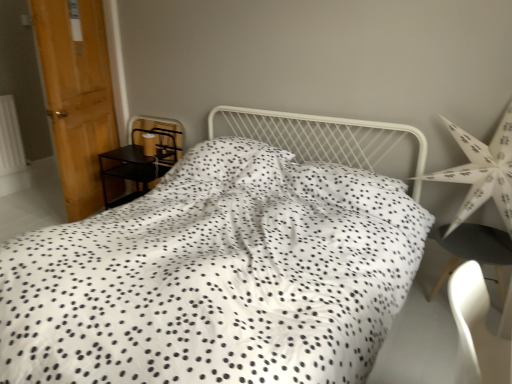
Question: Considering the relative positions of black matte chair at lower right and wooden door at left in the image provided, is black matte chair at lower right to the right of wooden door at left from the viewer's perspective?

Choices:
 (A) yes
 (B) no

Answer: (A)

Question: Can you confirm if black matte chair at lower right is smaller than wooden door at left?

Choices:
 (A) yes
 (B) no

Answer: (A)

Question: Can you confirm if black matte chair at lower right is wider than wooden door at left?

Choices:
 (A) yes
 (B) no

Answer: (B)

Question: Does black matte chair at lower right appear on the left side of wooden door at left?

Choices:
 (A) no
 (B) yes

Answer: (A)

Question: Can you confirm if black matte chair at lower right is bigger than wooden door at left?

Choices:
 (A) yes
 (B) no

Answer: (B)

Question: Considering the positions of matte brown lampshade at left and black matte chair at lower right in the image, is matte brown lampshade at left taller or shorter than black matte chair at lower right?

Choices:
 (A) short
 (B) tall

Answer: (A)

Question: Is matte brown lampshade at left in front of or behind black matte chair at lower right in the image?

Choices:
 (A) behind
 (B) front

Answer: (A)

Question: Looking at their shapes, would you say matte brown lampshade at left is wider or thinner than black matte chair at lower right?

Choices:
 (A) wide
 (B) thin

Answer: (B)

Question: In terms of size, does matte brown lampshade at left appear bigger or smaller than black matte chair at lower right?

Choices:
 (A) small
 (B) big

Answer: (A)

Question: Based on their sizes in the image, would you say white paper star at right is bigger or smaller than wooden door at left?

Choices:
 (A) small
 (B) big

Answer: (B)

Question: In terms of width, does white paper star at right look wider or thinner when compared to wooden door at left?

Choices:
 (A) wide
 (B) thin

Answer: (B)

Question: From the image's perspective, is white paper star at right located above or below wooden door at left?

Choices:
 (A) below
 (B) above

Answer: (A)

Question: Is point (476, 178) positioned closer to the camera than point (108, 139)?

Choices:
 (A) closer
 (B) farther

Answer: (A)

Question: Is white paper star at right in front of or behind matte brown lampshade at left in the image?

Choices:
 (A) front
 (B) behind

Answer: (A)

Question: From the image's perspective, relative to matte brown lampshade at left, is white paper star at right above or below?

Choices:
 (A) below
 (B) above

Answer: (A)